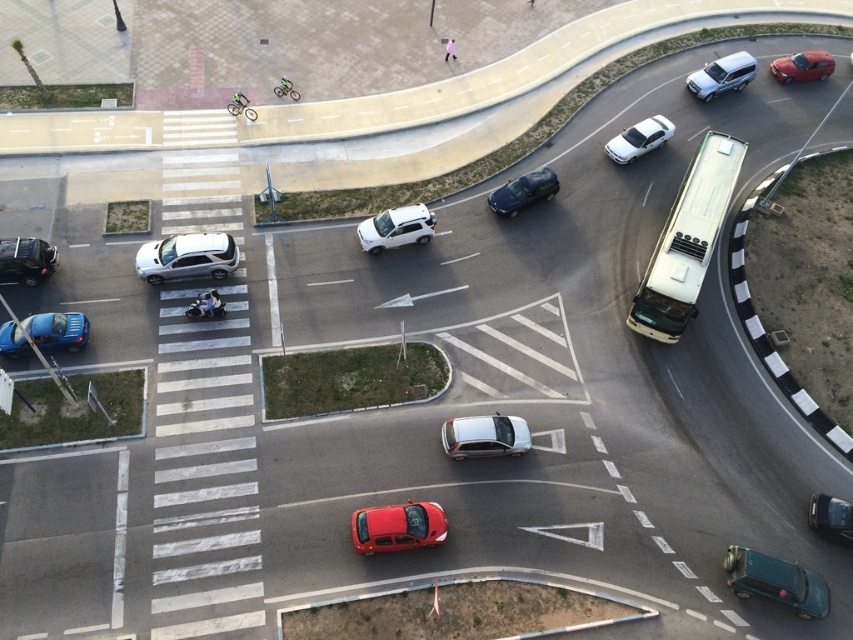
Question: Does shiny red sedan at lower right have a greater width compared to matte black bicycle at upper left?

Choices:
 (A) yes
 (B) no

Answer: (B)

Question: Is white metallic bus at right wider than matte black bicycle at upper left?

Choices:
 (A) no
 (B) yes

Answer: (B)

Question: Which point appears farthest from the camera in this image?

Choices:
 (A) (55, 253)
 (B) (531, 202)

Answer: (B)

Question: Which of the following is the closest to the observer?

Choices:
 (A) white metallic bus at right
 (B) matte black car at left

Answer: (A)

Question: Which point is farther to the camera?

Choices:
 (A) (280, 81)
 (B) (489, 438)
 (C) (676, 212)
 (D) (781, 61)

Answer: (D)

Question: Does satin silver suv at upper right have a greater width compared to metallic silver bicycle at center?

Choices:
 (A) yes
 (B) no

Answer: (A)